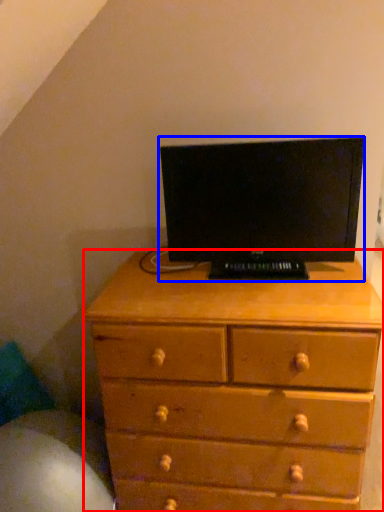
Question: Which object is further to the camera taking this photo, chest of drawers (highlighted by a red box) or computer monitor (highlighted by a blue box)?

Choices:
 (A) chest of drawers
 (B) computer monitor

Answer: (B)